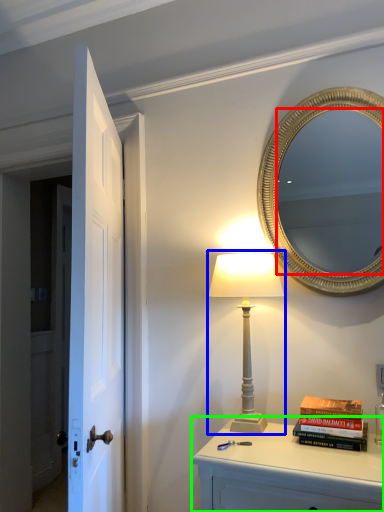
Question: Estimate the real-world distances between objects in this image. Which object is farther from mirror (highlighted by a red box), table lamp (highlighted by a blue box) or nightstand (highlighted by a green box)?

Choices:
 (A) table lamp
 (B) nightstand

Answer: (B)